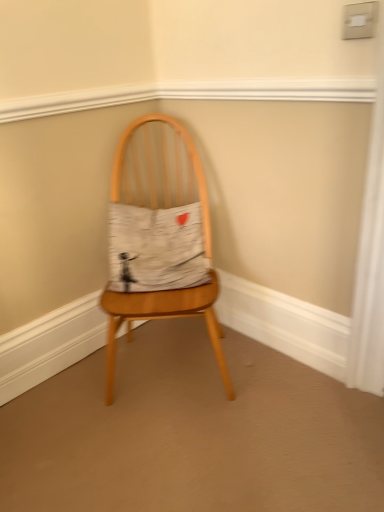
Question: Is wooden chair at center turned away from white cotton cushion at center?

Choices:
 (A) yes
 (B) no

Answer: (A)

Question: Is wooden chair at center in front of white cotton cushion at center?

Choices:
 (A) yes
 (B) no

Answer: (A)

Question: Is wooden chair at center facing towards white cotton cushion at center?

Choices:
 (A) no
 (B) yes

Answer: (B)

Question: Is wooden chair at center at the right side of white cotton cushion at center?

Choices:
 (A) yes
 (B) no

Answer: (A)

Question: From the image's perspective, is wooden chair at center under white cotton cushion at center?

Choices:
 (A) yes
 (B) no

Answer: (A)

Question: Is wooden chair at center smaller than white cotton cushion at center?

Choices:
 (A) no
 (B) yes

Answer: (A)

Question: Can you confirm if white cotton cushion at center is thinner than wooden chair at center?

Choices:
 (A) no
 (B) yes

Answer: (B)

Question: From the image's perspective, is white cotton cushion at center on top of wooden chair at center?

Choices:
 (A) no
 (B) yes

Answer: (B)

Question: Is white cotton cushion at center outside of wooden chair at center?

Choices:
 (A) no
 (B) yes

Answer: (A)

Question: Is white cotton cushion at center looking in the opposite direction of wooden chair at center?

Choices:
 (A) yes
 (B) no

Answer: (A)

Question: Can you confirm if white cotton cushion at center is wider than wooden chair at center?

Choices:
 (A) yes
 (B) no

Answer: (B)

Question: From a real-world perspective, is white cotton cushion at center physically below wooden chair at center?

Choices:
 (A) yes
 (B) no

Answer: (B)

Question: Looking at the image, does wooden chair at center seem bigger or smaller compared to white cotton cushion at center?

Choices:
 (A) big
 (B) small

Answer: (A)